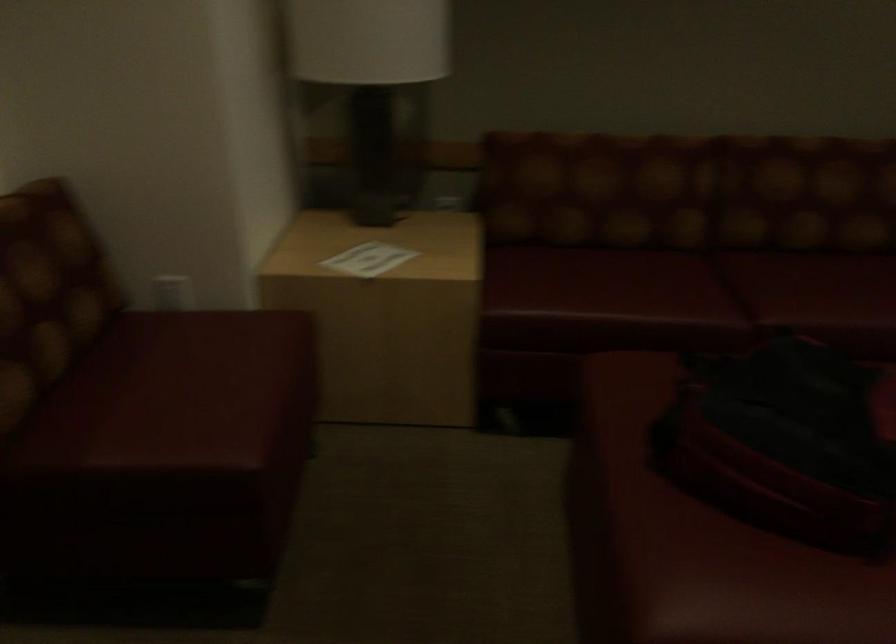
The image size is (896, 644). What do you see at coordinates (175, 393) in the screenshot?
I see `the red chair sitting surface` at bounding box center [175, 393].